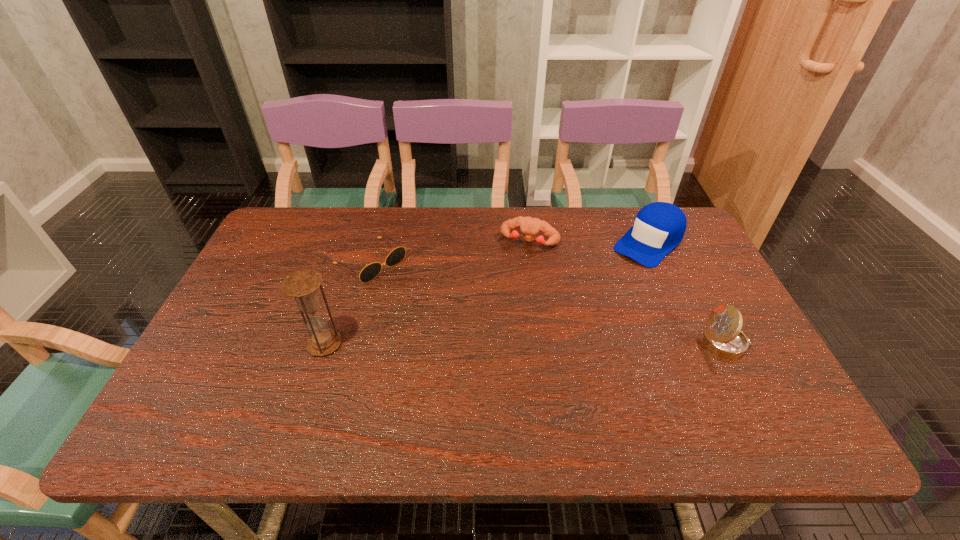
Identify the location of the tallest object. This screenshot has width=960, height=540. (302, 285).

You are a GUI agent. You are given a task and a screenshot of the screen. Output one action in this format:
    pyautogui.click(x=<x>, y=<y>)
    Task: Click on the compass
    
    Given the screenshot: What is the action you would take?
    pyautogui.click(x=723, y=336)

This screenshot has height=540, width=960. What are the coordinates of `the shortest object` in the screenshot? It's located at (368, 273).

Locate an element on the screen. the second shortest object is located at coordinates (530, 227).

This screenshot has width=960, height=540. Find the location of `the third object from right to left`. the third object from right to left is located at coordinates (530, 227).

The image size is (960, 540). Find the location of `baseball cap`. baseball cap is located at coordinates [x=659, y=227].

At what (x,y) coordinates should I click in order to perform the action: click on vacant space located on the right of the tallest object. Please return your answer as a coordinate pair (x, y). Looking at the image, I should click on [501, 344].

The height and width of the screenshot is (540, 960). In order to click on vacant region located on the front-facing side of the sunglasses in this screenshot , I will do `click(456, 323)`.

Image resolution: width=960 pixels, height=540 pixels. I want to click on vacant space located on the front-facing side of the sunglasses, so click(420, 297).

Find the location of a particular element. vacant space located on the front-facing side of the sunglasses is located at coordinates (445, 315).